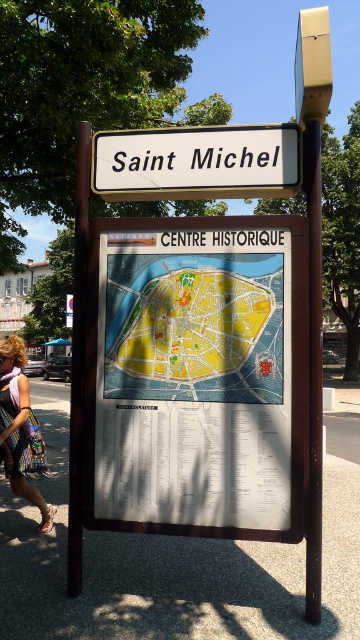
Question: Does yellow paper map at center appear on the left side of brown wooden pole at left?

Choices:
 (A) yes
 (B) no

Answer: (B)

Question: Does brown wooden pole at left lie behind multicolored woven dress at lower left?

Choices:
 (A) yes
 (B) no

Answer: (B)

Question: Which of the following is the closest to the observer?

Choices:
 (A) multicolored woven dress at lower left
 (B) brown wooden pole at left
 (C) white paper map at center

Answer: (C)

Question: Among these objects, which one is farthest from the camera?

Choices:
 (A) yellow paper map at center
 (B) brown wooden pole at left
 (C) white plastic sign at upper center
 (D) white paper map at center

Answer: (C)

Question: Estimate the real-world distances between objects in this image. Which object is farther from the yellow paper map at center?

Choices:
 (A) multicolored woven dress at lower left
 (B) white plastic sign at upper center

Answer: (A)

Question: Is white plastic sign at upper center above multicolored woven dress at lower left?

Choices:
 (A) no
 (B) yes

Answer: (B)